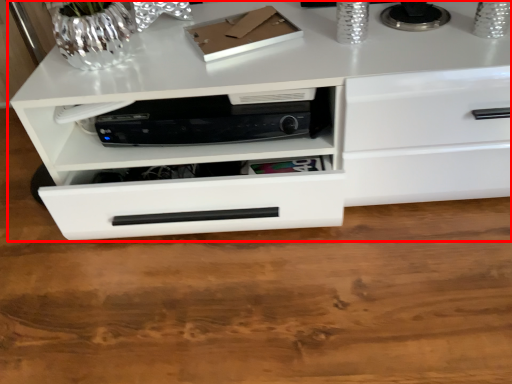
Question: From the image, what is the correct spatial relationship of chest of drawers (annotated by the red box) in relation to home appliance?

Choices:
 (A) right
 (B) left

Answer: (A)